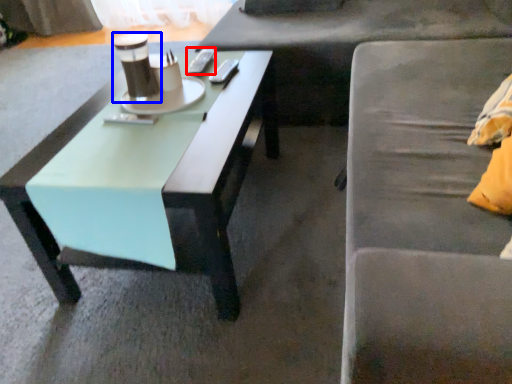
Question: Which point is closer to the camera, remote control (highlighted by a red box) or coffee cup (highlighted by a blue box)?

Choices:
 (A) remote control
 (B) coffee cup

Answer: (B)